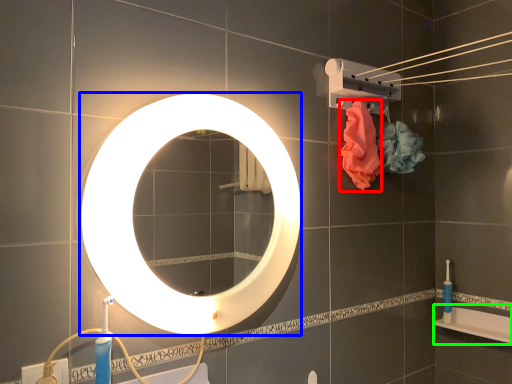
Question: Considering the real-world distances, which object is farthest from flower (highlighted by a red box)? mirror (highlighted by a blue box) or bath (highlighted by a green box)?

Choices:
 (A) mirror
 (B) bath

Answer: (B)